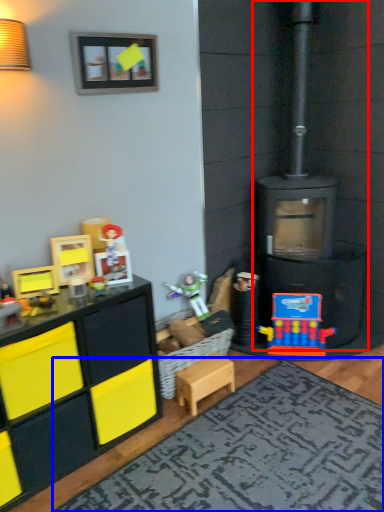
Question: Which point is further to the camera, fireplace (highlighted by a red box) or mat (highlighted by a blue box)?

Choices:
 (A) fireplace
 (B) mat

Answer: (A)